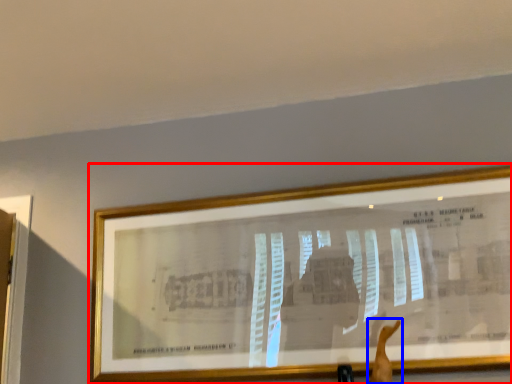
Question: Among these objects, which one is farthest to the camera, picture frame (highlighted by a red box) or arm (highlighted by a blue box)?

Choices:
 (A) picture frame
 (B) arm

Answer: (A)